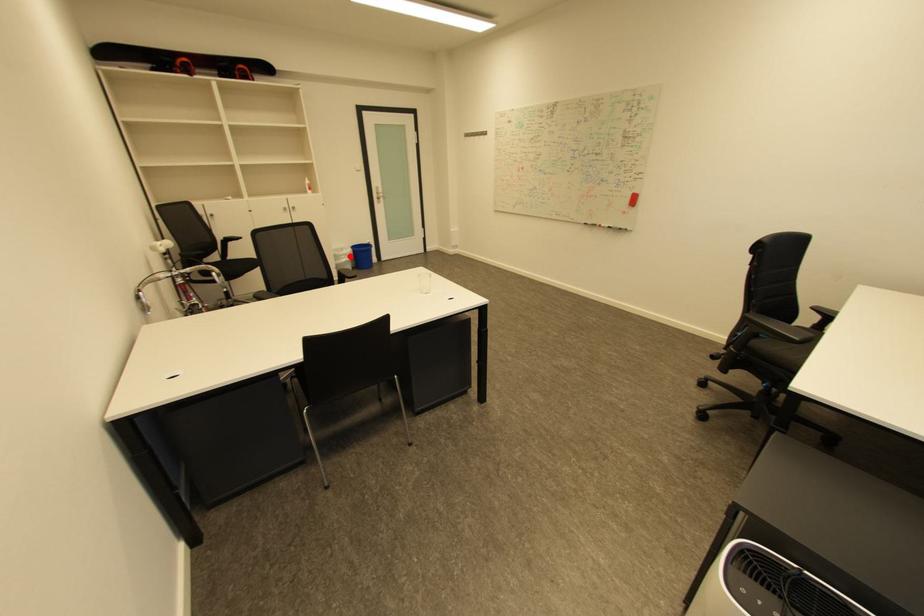
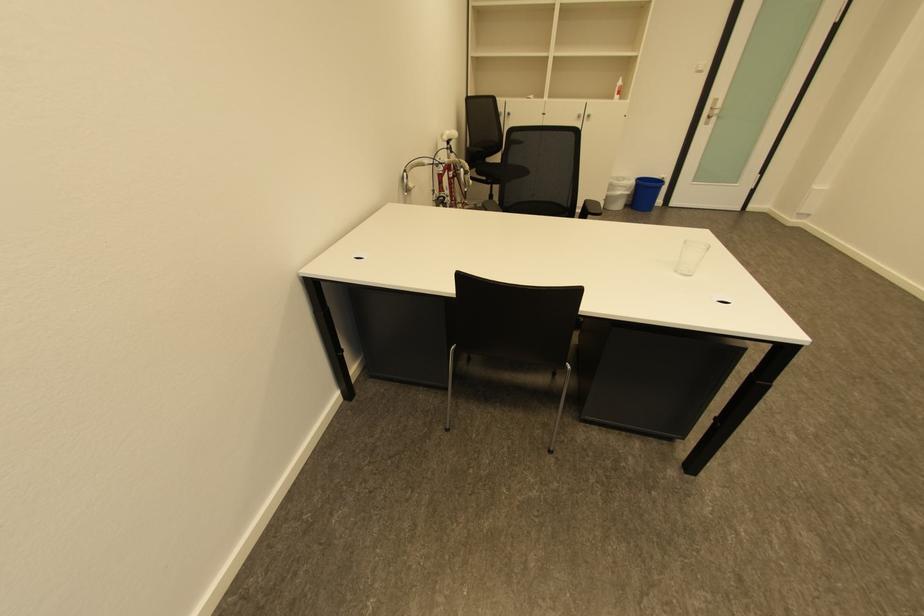
The point at the highlighted location is marked in the first image. Where is the corresponding point in the second image?

(626, 188)